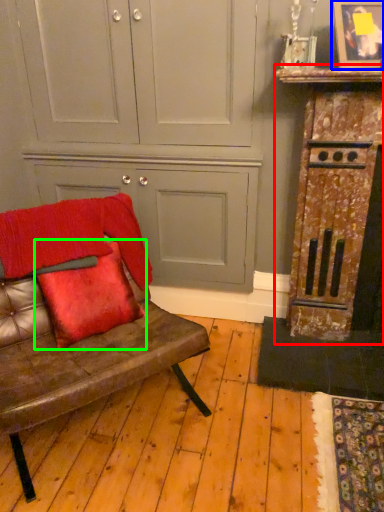
Question: Which object is the farthest from dresser (highlighted by a red box)? Choose among these: picture frame (highlighted by a blue box) or pillow (highlighted by a green box).

Choices:
 (A) picture frame
 (B) pillow

Answer: (B)